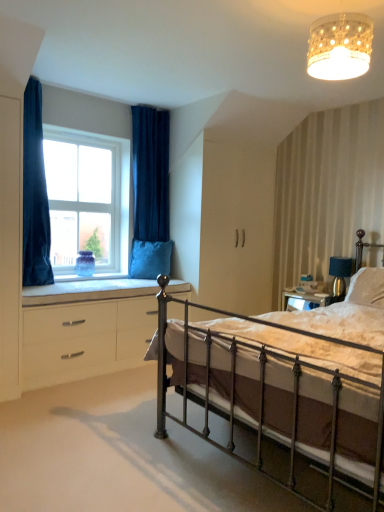
Question: Is blue velvet cushion at lower left with white textured pillow at right, the second pillow in the back-to-front sequence?

Choices:
 (A) yes
 (B) no

Answer: (B)

Question: Does blue velvet cushion at lower left have a larger size compared to white textured pillow at right, the second pillow in the back-to-front sequence?

Choices:
 (A) no
 (B) yes

Answer: (B)

Question: Does blue velvet cushion at lower left have a greater width compared to white textured pillow at right, which appears as the first pillow when viewed from the right?

Choices:
 (A) no
 (B) yes

Answer: (B)

Question: Could white textured pillow at right, the second pillow when ordered from left to right, be considered to be inside blue velvet cushion at lower left?

Choices:
 (A) no
 (B) yes

Answer: (A)

Question: Is blue velvet cushion at lower left turned away from white textured pillow at right, the second pillow in the back-to-front sequence?

Choices:
 (A) yes
 (B) no

Answer: (B)

Question: Would you consider blue velvet cushion at lower left to be distant from white textured pillow at right, acting as the first pillow starting from the front?

Choices:
 (A) no
 (B) yes

Answer: (B)

Question: Does polished metal bed at center have a smaller size compared to velvet blue pillow at window, the 2th pillow when ordered from front to back?

Choices:
 (A) yes
 (B) no

Answer: (B)

Question: Considering the relative positions of polished metal bed at center and velvet blue pillow at window, the first pillow in the left-to-right sequence, in the image provided, is polished metal bed at center to the right of velvet blue pillow at window, the first pillow in the left-to-right sequence, from the viewer's perspective?

Choices:
 (A) no
 (B) yes

Answer: (B)

Question: From a real-world perspective, does polished metal bed at center sit lower than velvet blue pillow at window, the 2th pillow when ordered from front to back?

Choices:
 (A) no
 (B) yes

Answer: (B)

Question: Is polished metal bed at center wider than velvet blue pillow at window, which is counted as the 2th pillow, starting from the right?

Choices:
 (A) no
 (B) yes

Answer: (B)

Question: Considering the relative positions of polished metal bed at center and velvet blue pillow at window, which is counted as the 2th pillow, starting from the right, in the image provided, is polished metal bed at center behind velvet blue pillow at window, which is counted as the 2th pillow, starting from the right,?

Choices:
 (A) no
 (B) yes

Answer: (A)

Question: Can we say polished metal bed at center lies outside velvet blue pillow at window, placed as the first pillow when sorted from back to front?

Choices:
 (A) no
 (B) yes

Answer: (B)

Question: Considering the relative sizes of white glass window at upper left and velvet blue curtain at upper left, the first curtain when ordered from right to left, in the image provided, is white glass window at upper left bigger than velvet blue curtain at upper left, the first curtain when ordered from right to left,?

Choices:
 (A) no
 (B) yes

Answer: (A)